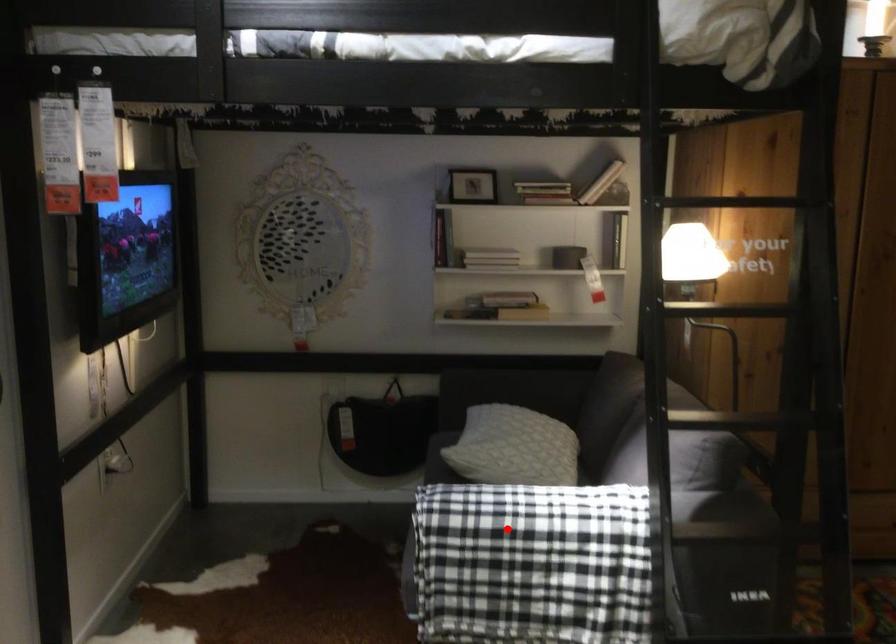
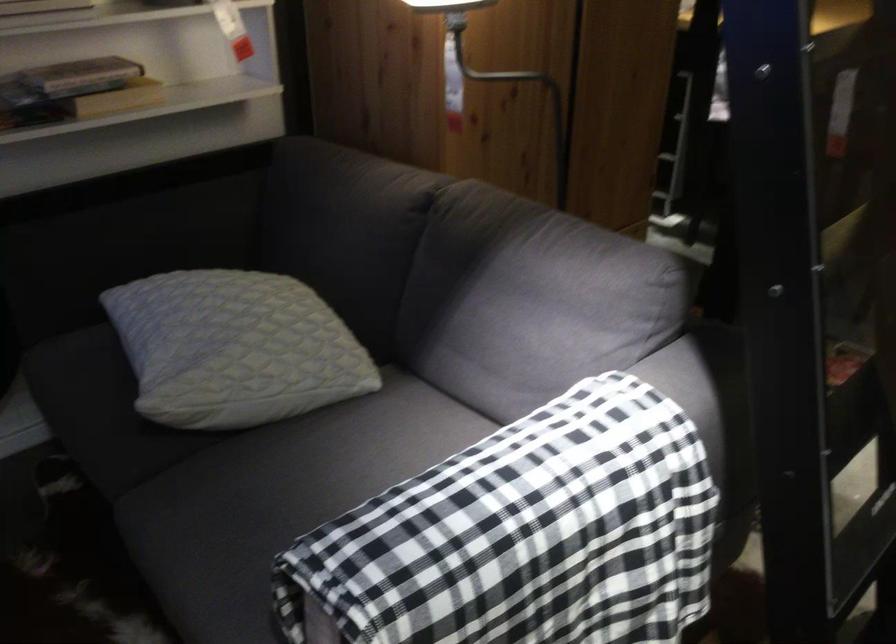
Find the pixel in the second image that matches the highlighted location in the first image.

(522, 536)